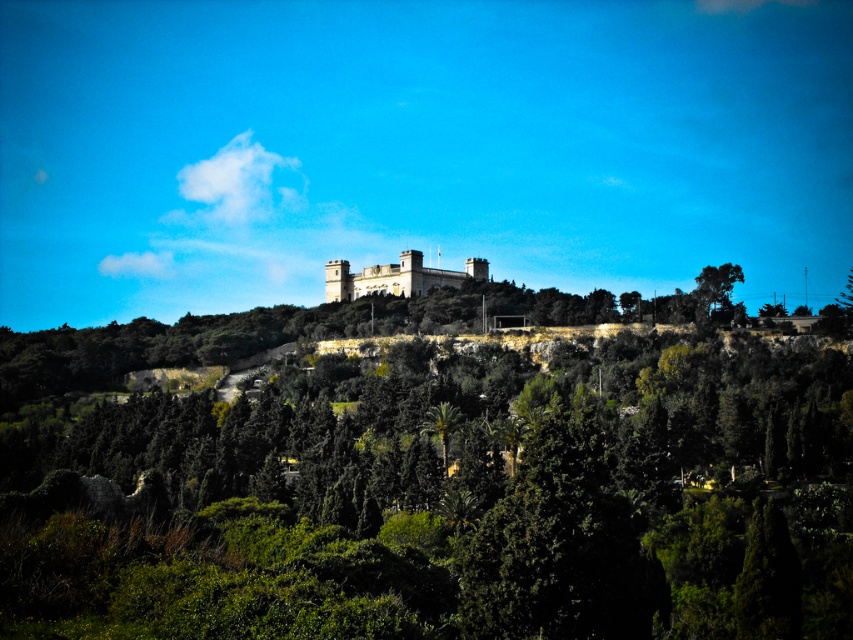
Is stone castle at center to the right of green leafy tree at upper right from the viewer's perspective?

No, stone castle at center is not to the right of green leafy tree at upper right.

Is stone castle at center to the left of green leafy tree at upper right from the viewer's perspective?

Indeed, stone castle at center is positioned on the left side of green leafy tree at upper right.

The image size is (853, 640). Describe the element at coordinates (396, 276) in the screenshot. I see `stone castle at center` at that location.

You are a GUI agent. You are given a task and a screenshot of the screen. Output one action in this format:
    pyautogui.click(x=<x>, y=<y>)
    Task: Click on the stone castle at center
    The image size is (853, 640).
    Given the screenshot: What is the action you would take?
    pyautogui.click(x=396, y=276)